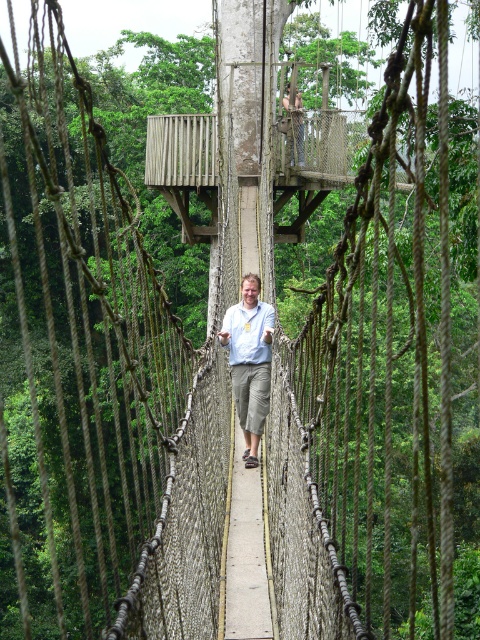
Question: Does wooden platform at upper center have a lesser width compared to matte gray pants at center?

Choices:
 (A) no
 (B) yes

Answer: (A)

Question: Does matte blue shirt at center have a larger size compared to matte gray pants at center?

Choices:
 (A) yes
 (B) no

Answer: (B)

Question: Does wooden platform at upper center appear over matte blue shirt at center?

Choices:
 (A) yes
 (B) no

Answer: (A)

Question: Which of these objects is positioned farthest from the matte blue shirt at center?

Choices:
 (A) matte gray pants at center
 (B) wooden platform at upper center

Answer: (A)

Question: Which of the following is the farthest from the observer?

Choices:
 (A) (250, 388)
 (B) (295, 136)
 (C) (183, 124)

Answer: (C)

Question: Which of these objects is positioned closest to the matte blue shirt at center?

Choices:
 (A) matte gray pants at center
 (B) wooden platform at upper center

Answer: (B)